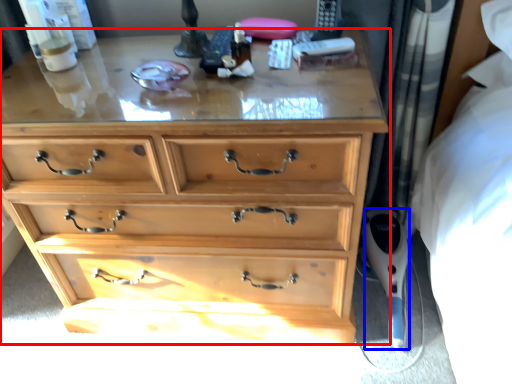
Question: Which object appears farthest to the camera in this image, chest of drawers (highlighted by a red box) or equipment (highlighted by a blue box)?

Choices:
 (A) chest of drawers
 (B) equipment

Answer: (B)